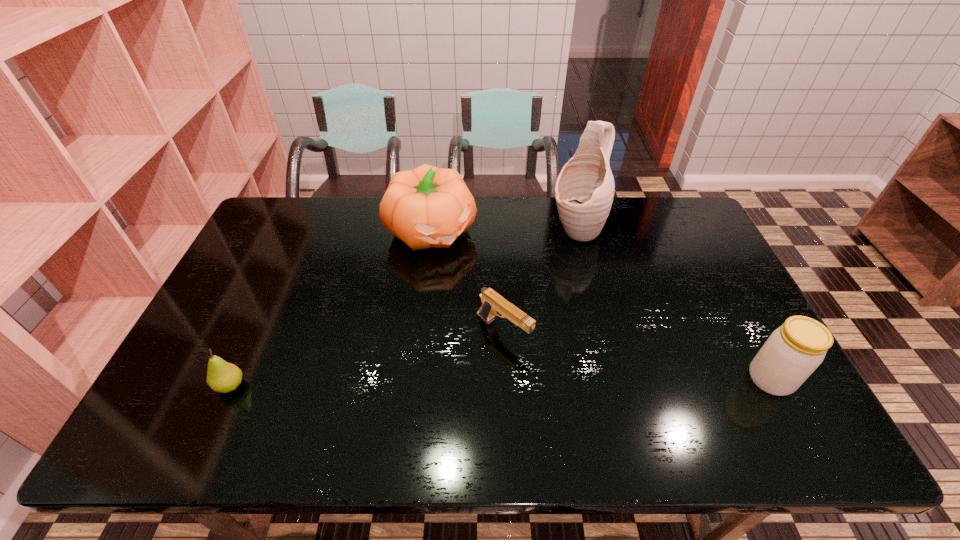
Find the location of a particular element. This screenshot has height=540, width=960. vacant area situated 0.110m on the back of the third shortest object is located at coordinates (743, 327).

Where is `blank space located 0.290m on the carved face of the pumpkin`? blank space located 0.290m on the carved face of the pumpkin is located at coordinates (505, 314).

Where is `free region located on the carved face of the pumpkin`? free region located on the carved face of the pumpkin is located at coordinates (522, 333).

Identify the location of vacant space located 0.190m on the carved face of the pumpkin. (486, 292).

What are the coordinates of `vacant area located 0.060m at the barrel of the pistol` in the screenshot? It's located at (541, 361).

At what (x,y) coordinates should I click in order to perform the action: click on free space located at the barrel of the pistol. Please return your answer as a coordinate pair (x, y). Looking at the image, I should click on (554, 371).

You are a GUI agent. You are given a task and a screenshot of the screen. Output one action in this format:
    pyautogui.click(x=<x>, y=<y>)
    Task: Click on the vacant point located at the barrel of the pistol
    
    Given the screenshot: What is the action you would take?
    pyautogui.click(x=587, y=396)

Locate an element on the screen. The height and width of the screenshot is (540, 960). free space located 0.300m at the spout of the pitcher is located at coordinates (510, 299).

Identify the location of free space located 0.330m at the spout of the pitcher. Image resolution: width=960 pixels, height=540 pixels. (503, 305).

The height and width of the screenshot is (540, 960). I want to click on free spot located 0.300m at the spout of the pitcher, so click(510, 299).